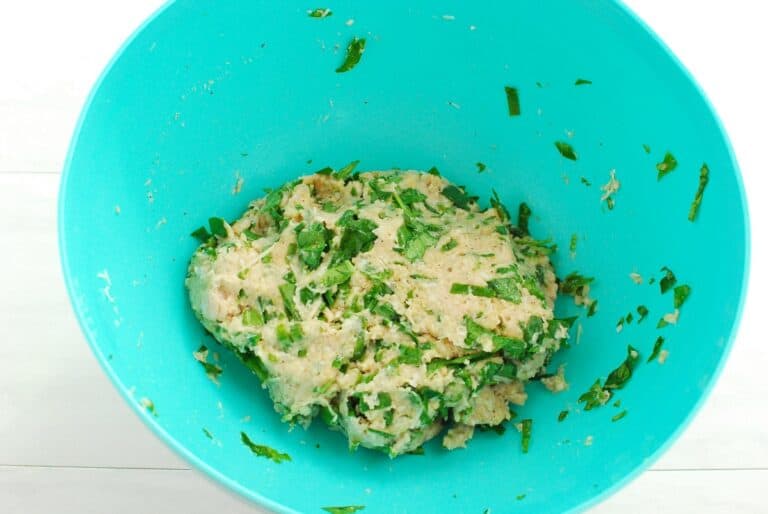
Image resolution: width=768 pixels, height=514 pixels. In order to click on groove in the table top in this screenshot , I will do click(x=111, y=465), click(x=722, y=469).